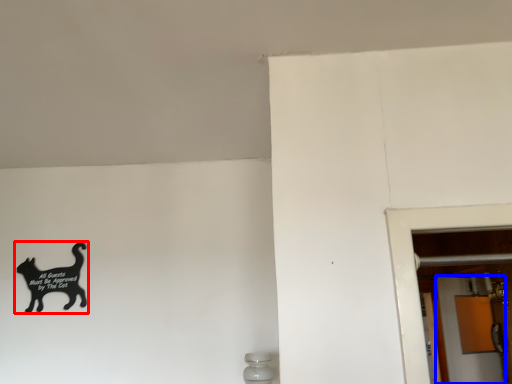
Question: Which point is closer to the camera, cat (highlighted by a red box) or screen door (highlighted by a blue box)?

Choices:
 (A) cat
 (B) screen door

Answer: (A)